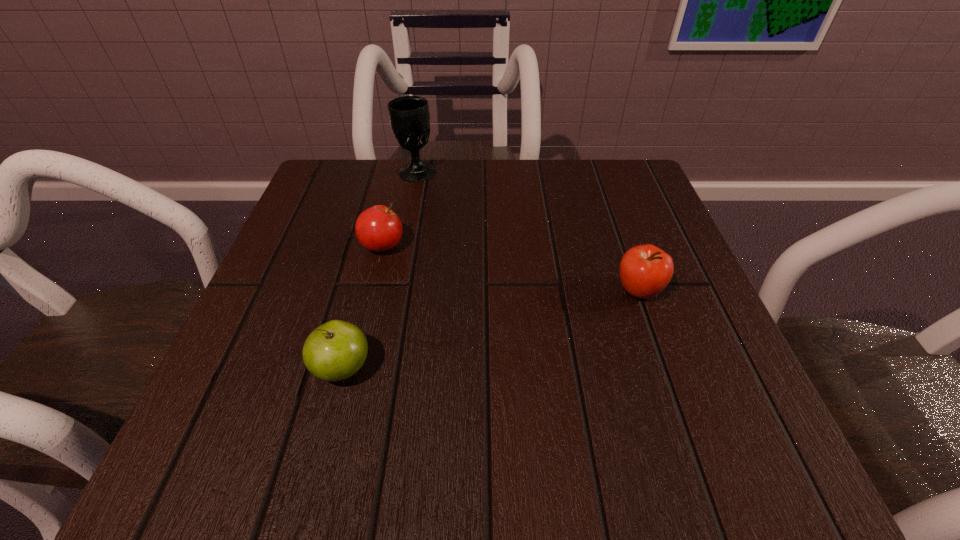
This screenshot has width=960, height=540. What are the coordinates of `free space between the chalice and the nearest object` in the screenshot? It's located at (380, 269).

I want to click on free space between the farthest apple and the second nearest object, so click(x=511, y=268).

Identify the location of vacant space in between the third nearest object and the nearest apple. (363, 307).

Find the location of a particular element. free point between the farthest apple and the chalice is located at coordinates (399, 208).

Identify the location of unoccupied area between the tallest object and the rightmost apple. (527, 231).

The height and width of the screenshot is (540, 960). I want to click on vacant point located between the nearest apple and the shortest object, so click(363, 307).

Locate an element on the screen. This screenshot has width=960, height=540. free space that is in between the nearest object and the chalice is located at coordinates 380,269.

Identify the location of free space between the rightmost apple and the third nearest object. The image size is (960, 540). (511, 268).

The width and height of the screenshot is (960, 540). In order to click on unoccupied position between the second farthest object and the second farthest apple in this screenshot , I will do `click(511, 268)`.

You are a GUI agent. You are given a task and a screenshot of the screen. Output one action in this format:
    pyautogui.click(x=<x>, y=<y>)
    Task: Click on the free space between the second farthest apple and the tallest object
    The height and width of the screenshot is (540, 960).
    Given the screenshot: What is the action you would take?
    pyautogui.click(x=527, y=231)